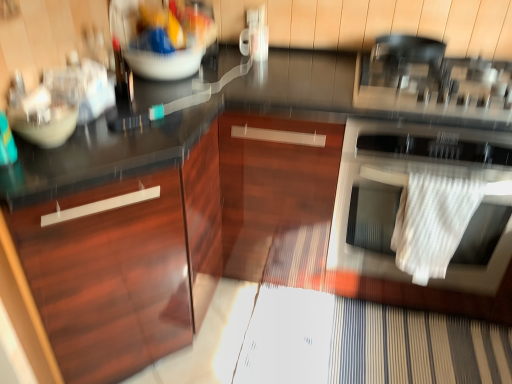
Question: Is white textured towel at right bigger or smaller than white textured towel at right?

Choices:
 (A) big
 (B) small

Answer: (B)

Question: Is point (418, 244) closer or farther from the camera than point (428, 297)?

Choices:
 (A) farther
 (B) closer

Answer: (B)

Question: Estimate the real-world distances between objects in this image. Which object is closer to the matte white bowl at left?

Choices:
 (A) matte plastic bowl at upper center
 (B) white textured towel at right
 (C) glossy wood cabinet at left
 (D) white textured towel at right

Answer: (C)

Question: Considering the real-world distances, which object is farthest from the white textured towel at right?

Choices:
 (A) white textured towel at right
 (B) glossy wood cabinet at left
 (C) matte white bowl at left
 (D) matte plastic bowl at upper center

Answer: (C)